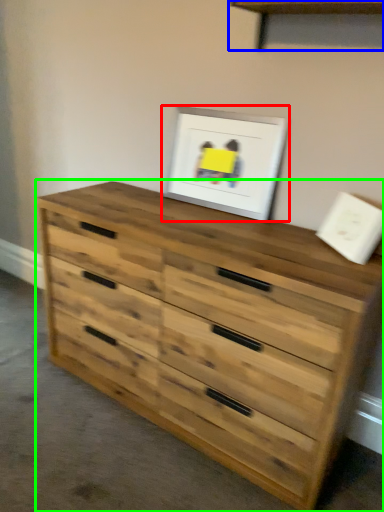
Question: Estimate the real-world distances between objects in this image. Which object is farther from picture frame (highlighted by a red box), shelf (highlighted by a blue box) or chest of drawers (highlighted by a green box)?

Choices:
 (A) shelf
 (B) chest of drawers

Answer: (B)